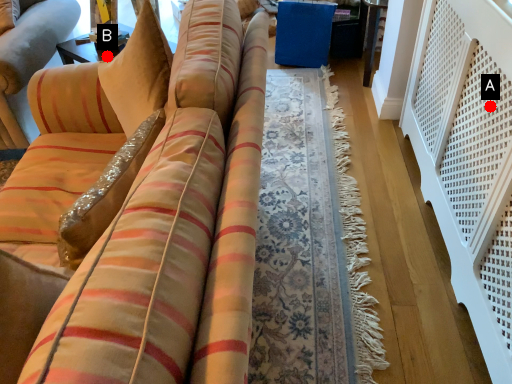
Question: Two points are circled on the image, labeled by A and B beside each circle. Which of the following is the closest to the observer?

Choices:
 (A) A is closer
 (B) B is closer

Answer: (A)